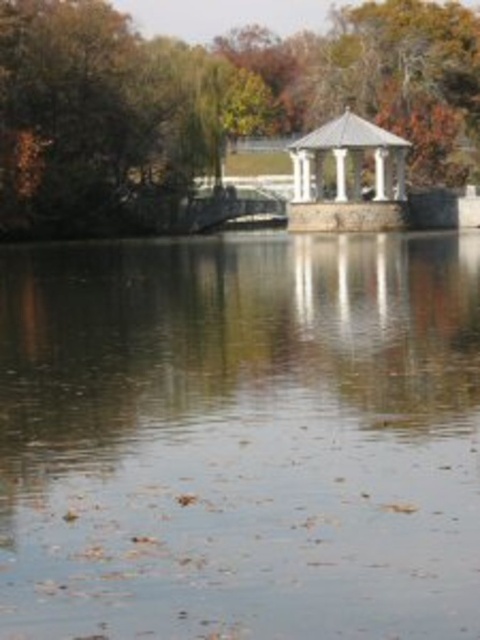
You are planning to place a small floating dock in the lakeside scene. The dock must be placed in an area where the clear water at center is larger than the white stone gazebo at center. Where should you position the dock?

The clear water at center is bigger than the white stone gazebo at center, so the dock should be placed in the area where the clear water at center is located.